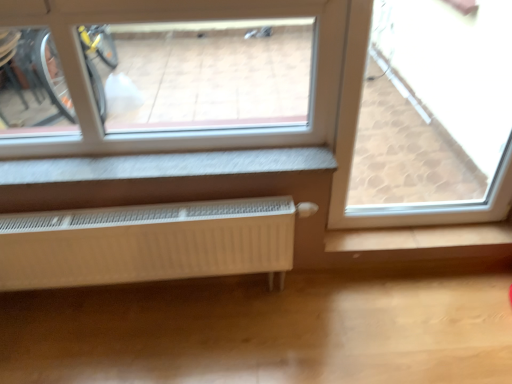
This screenshot has width=512, height=384. Find the location of `free point to the right of white matte radiator at lower center`. free point to the right of white matte radiator at lower center is located at coordinates (312, 326).